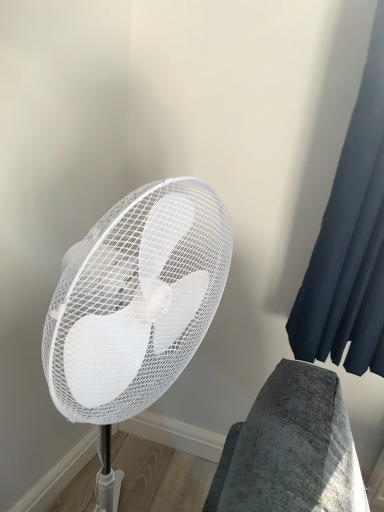
Question: Is white mesh fan at center not near dark blue fabric at right?

Choices:
 (A) yes
 (B) no

Answer: (B)

Question: From a real-world perspective, is white mesh fan at center physically above dark blue fabric at right?

Choices:
 (A) yes
 (B) no

Answer: (B)

Question: Does white mesh fan at center have a lesser width compared to dark blue fabric at right?

Choices:
 (A) yes
 (B) no

Answer: (B)

Question: From a real-world perspective, is white mesh fan at center located beneath dark blue fabric at right?

Choices:
 (A) yes
 (B) no

Answer: (A)

Question: Is white mesh fan at center further to camera compared to dark blue fabric at right?

Choices:
 (A) no
 (B) yes

Answer: (A)

Question: Is white mesh fan at center completely or partially outside of dark blue fabric at right?

Choices:
 (A) no
 (B) yes

Answer: (B)

Question: Considering the relative sizes of dark blue fabric at right and white mesh fan at center in the image provided, is dark blue fabric at right taller than white mesh fan at center?

Choices:
 (A) no
 (B) yes

Answer: (A)

Question: Can you confirm if dark blue fabric at right is smaller than white mesh fan at center?

Choices:
 (A) yes
 (B) no

Answer: (A)

Question: Considering the relative sizes of dark blue fabric at right and white mesh fan at center in the image provided, is dark blue fabric at right thinner than white mesh fan at center?

Choices:
 (A) no
 (B) yes

Answer: (B)

Question: Does dark blue fabric at right have a lesser height compared to white mesh fan at center?

Choices:
 (A) no
 (B) yes

Answer: (B)

Question: From the image's perspective, would you say dark blue fabric at right is positioned over white mesh fan at center?

Choices:
 (A) no
 (B) yes

Answer: (B)

Question: Is dark blue fabric at right wider than white mesh fan at center?

Choices:
 (A) yes
 (B) no

Answer: (B)

Question: From a real-world perspective, relative to dark blue fabric at right, is white mesh fan at center vertically above or below?

Choices:
 (A) below
 (B) above

Answer: (A)